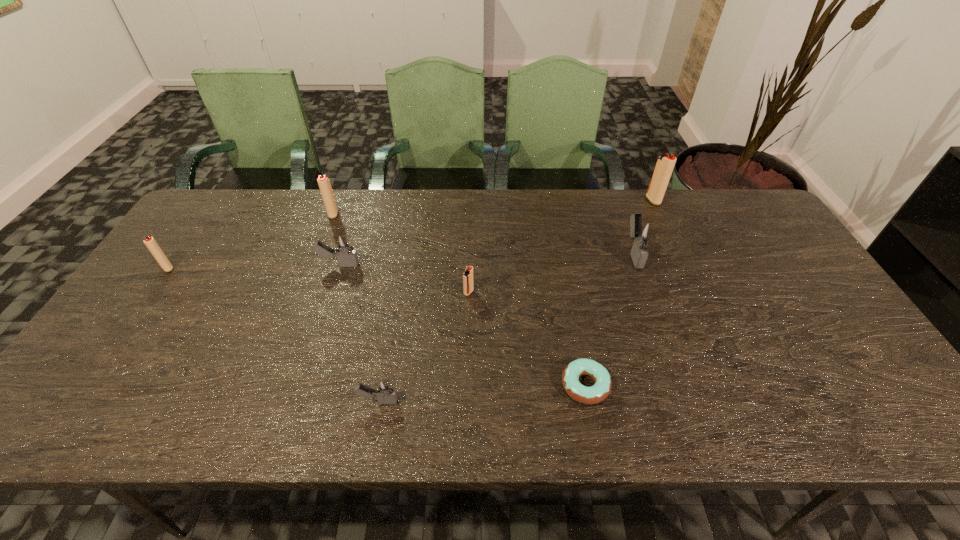
At what (x,y) coordinates should I click in order to perform the action: click on vacant area situated on the front of the fourth object from right to left. Please return your answer as a coordinate pair (x, y). This screenshot has height=540, width=960. Looking at the image, I should click on (468, 348).

Find the location of a particular element. free space located 0.080m on the left of the nearest gray igniter is located at coordinates (323, 401).

Identify the location of free location located on the left of the shortest object. This screenshot has height=540, width=960. (395, 385).

Where is `igniter that is at the near edge`? igniter that is at the near edge is located at coordinates (384, 390).

This screenshot has width=960, height=540. Find the location of `doughnut located at the near edge`. doughnut located at the near edge is located at coordinates (601, 389).

Identify the location of object that is at the left edge. (150, 242).

The image size is (960, 540). In the image, there is a desktop. Identify the location of vacant space at the far edge. (616, 199).

The image size is (960, 540). What are the coordinates of `free space at the near edge` in the screenshot? It's located at (631, 400).

Locate an element on the screen. This screenshot has height=540, width=960. free region at the left edge of the desktop is located at coordinates (142, 292).

Find the location of a particular element. This screenshot has height=540, width=960. vacant space at the right edge of the desktop is located at coordinates (808, 286).